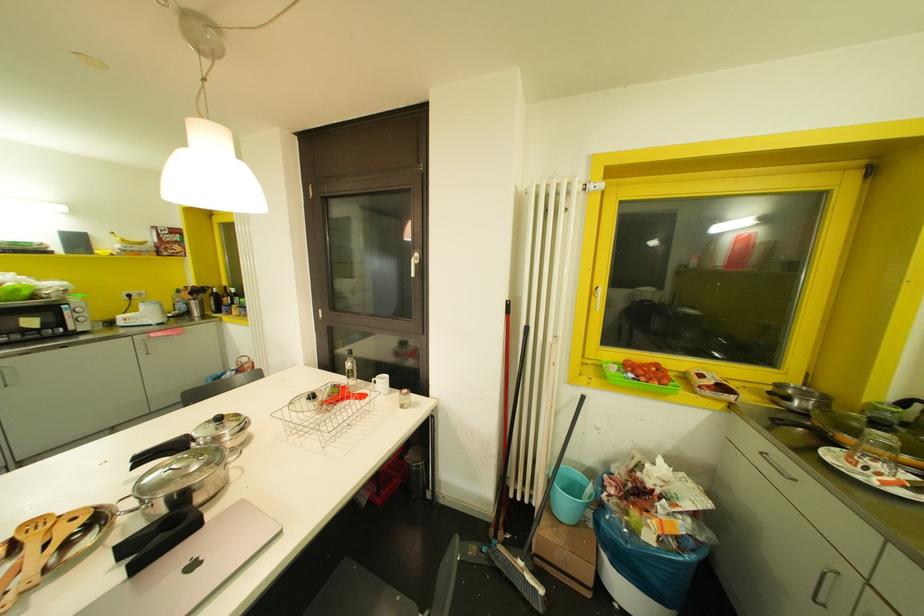
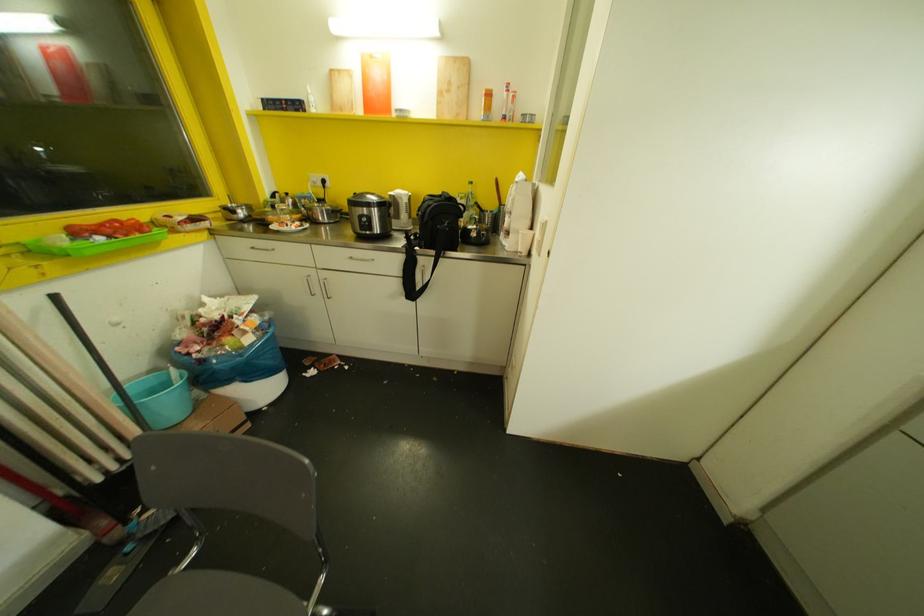
How did the camera likely rotate?

The rotation direction of the camera is right-down.